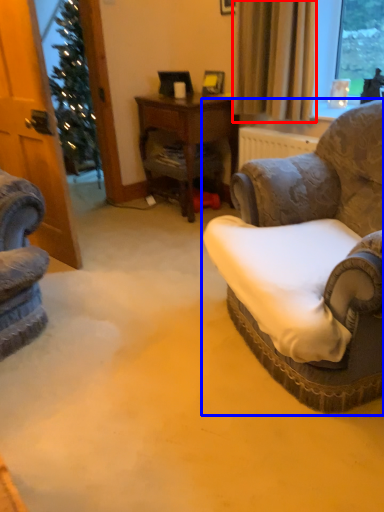
Question: Which point is further to the camera, curtain (highlighted by a red box) or chair (highlighted by a blue box)?

Choices:
 (A) curtain
 (B) chair

Answer: (A)